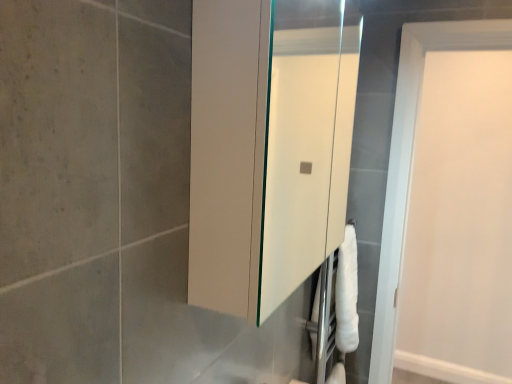
Question: Could white matte door at upper right be considered to be inside white glossy medicine cabinet at center?

Choices:
 (A) yes
 (B) no

Answer: (B)

Question: Is white glossy medicine cabinet at center far away from white matte door at upper right?

Choices:
 (A) no
 (B) yes

Answer: (B)

Question: Does white glossy medicine cabinet at center appear on the left side of white matte door at upper right?

Choices:
 (A) no
 (B) yes

Answer: (B)

Question: Is white glossy medicine cabinet at center aimed at white matte door at upper right?

Choices:
 (A) no
 (B) yes

Answer: (A)

Question: Is white matte door at upper right at the back of white glossy medicine cabinet at center?

Choices:
 (A) no
 (B) yes

Answer: (A)

Question: Choose the correct answer: Is white matte door at upper right inside white glossy medicine cabinet at center or outside it?

Choices:
 (A) inside
 (B) outside

Answer: (B)

Question: Based on their sizes in the image, would you say white matte door at upper right is bigger or smaller than white glossy medicine cabinet at center?

Choices:
 (A) big
 (B) small

Answer: (A)

Question: Is white matte door at upper right wider or thinner than white glossy medicine cabinet at center?

Choices:
 (A) wide
 (B) thin

Answer: (B)

Question: Is point (373, 372) positioned closer to the camera than point (314, 198)?

Choices:
 (A) farther
 (B) closer

Answer: (B)

Question: Is point (280, 135) closer or farther from the camera than point (340, 375)?

Choices:
 (A) farther
 (B) closer

Answer: (A)

Question: From their relative heights in the image, would you say white glossy medicine cabinet at center is taller or shorter than white matte toilet paper at lower right?

Choices:
 (A) short
 (B) tall

Answer: (B)

Question: From a real-world perspective, is white glossy medicine cabinet at center positioned above or below white matte toilet paper at lower right?

Choices:
 (A) below
 (B) above

Answer: (B)

Question: In terms of width, does white glossy medicine cabinet at center look wider or thinner when compared to white matte toilet paper at lower right?

Choices:
 (A) thin
 (B) wide

Answer: (B)

Question: Considering the positions of white matte toilet paper at lower right and white glossy medicine cabinet at center in the image, is white matte toilet paper at lower right wider or thinner than white glossy medicine cabinet at center?

Choices:
 (A) thin
 (B) wide

Answer: (A)

Question: Is white matte toilet paper at lower right to the left or to the right of white glossy medicine cabinet at center in the image?

Choices:
 (A) left
 (B) right

Answer: (B)